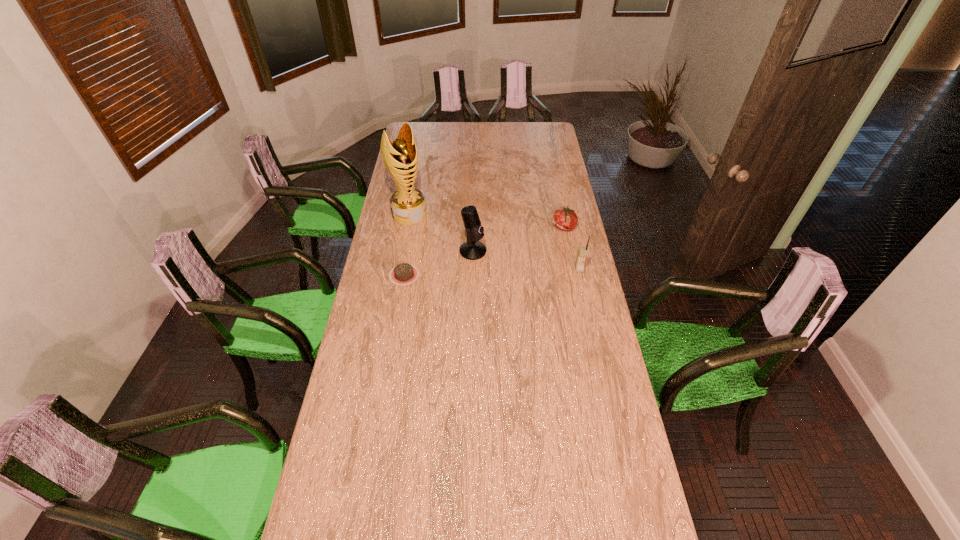
Find the location of a particular element. The image size is (960, 540). vacant spot on the desktop that is between the shortest object and the third shortest object and is positioned on the front-facing side of the tallest object is located at coordinates (467, 273).

At what (x,y) coordinates should I click in order to perform the action: click on vacant space on the desktop that is between the chocolate cake and the cellular telephone and is positioned on the front-facing side of the second shortest object. Please return your answer as a coordinate pair (x, y). Looking at the image, I should click on (487, 272).

Image resolution: width=960 pixels, height=540 pixels. In order to click on free space on the desktop that is between the shortest object and the third shortest object and is positioned on the stand of the second tallest object in this screenshot , I will do `click(511, 272)`.